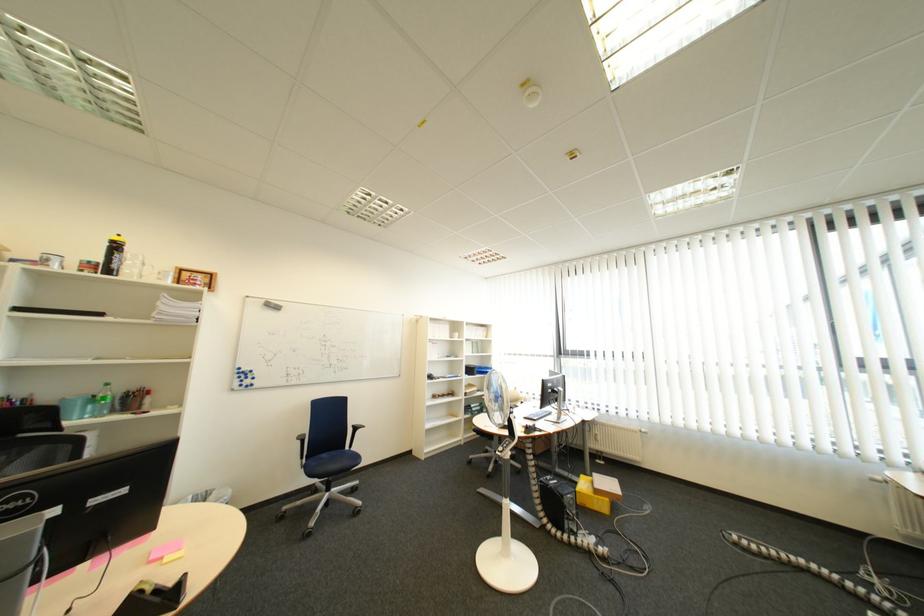
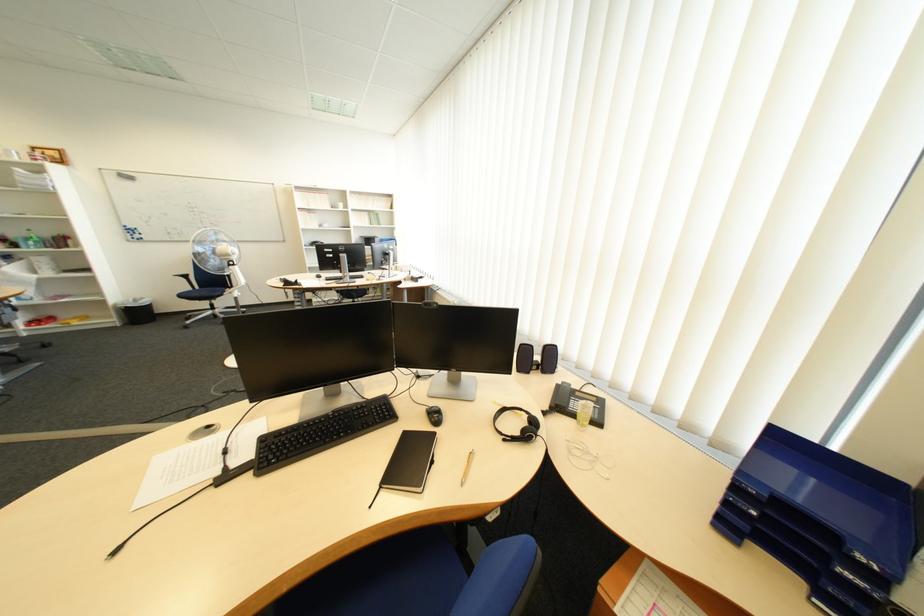
Where in the second image is the point corresponding to pixel 105 400 from the first image?

(41, 240)